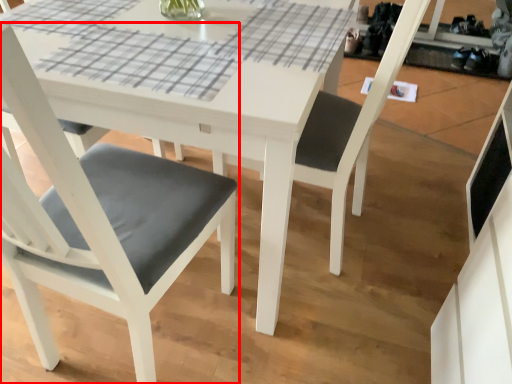
Question: Considering the relative positions of chair (annotated by the red box) and chair in the image provided, where is chair (annotated by the red box) located with respect to the staircase?

Choices:
 (A) left
 (B) right

Answer: (A)